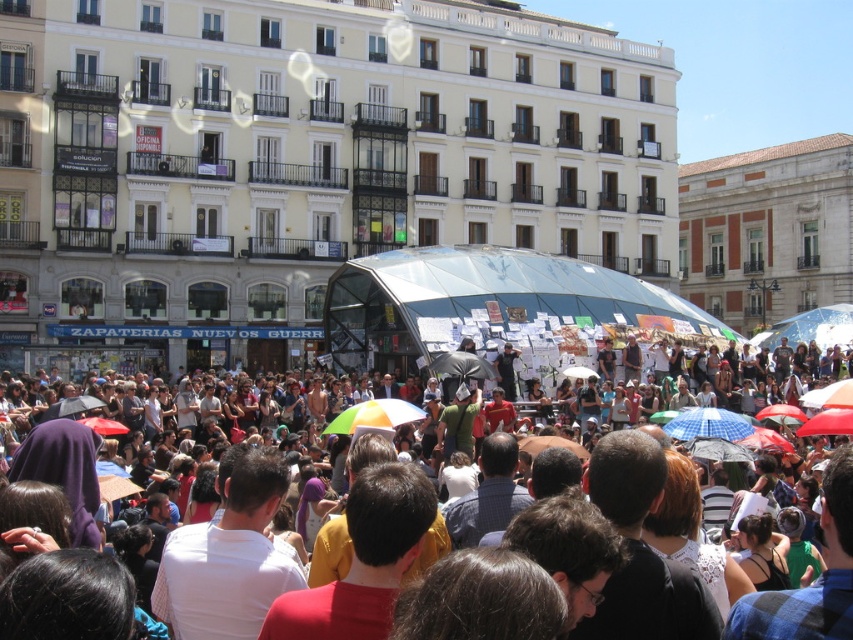
Between blue checkered umbrella at center and multicolored fabric umbrella at center, which one has more height?

Standing taller between the two is multicolored fabric umbrella at center.

The width and height of the screenshot is (853, 640). What do you see at coordinates (706, 424) in the screenshot?
I see `blue checkered umbrella at center` at bounding box center [706, 424].

Where is `blue checkered umbrella at center`? Image resolution: width=853 pixels, height=640 pixels. blue checkered umbrella at center is located at coordinates (706, 424).

Which is more to the right, multicolored umbrellas at center or blue checkered umbrella at center?

blue checkered umbrella at center is more to the right.

Can you confirm if multicolored umbrellas at center is positioned to the left of blue checkered umbrella at center?

Correct, you'll find multicolored umbrellas at center to the left of blue checkered umbrella at center.

The width and height of the screenshot is (853, 640). I want to click on multicolored umbrellas at center, so pos(289,557).

Does point (253, 568) come closer to viewer compared to point (366, 413)?

Yes, it is.

Locate an element on the screen. Image resolution: width=853 pixels, height=640 pixels. multicolored umbrellas at center is located at coordinates (289, 557).

This screenshot has width=853, height=640. I want to click on multicolored umbrellas at center, so click(x=289, y=557).